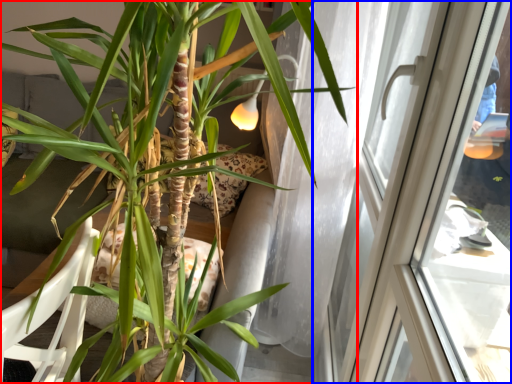
Question: Which object appears closest to the camera in this image, houseplant (highlighted by a red box) or window (highlighted by a blue box)?

Choices:
 (A) houseplant
 (B) window

Answer: (A)